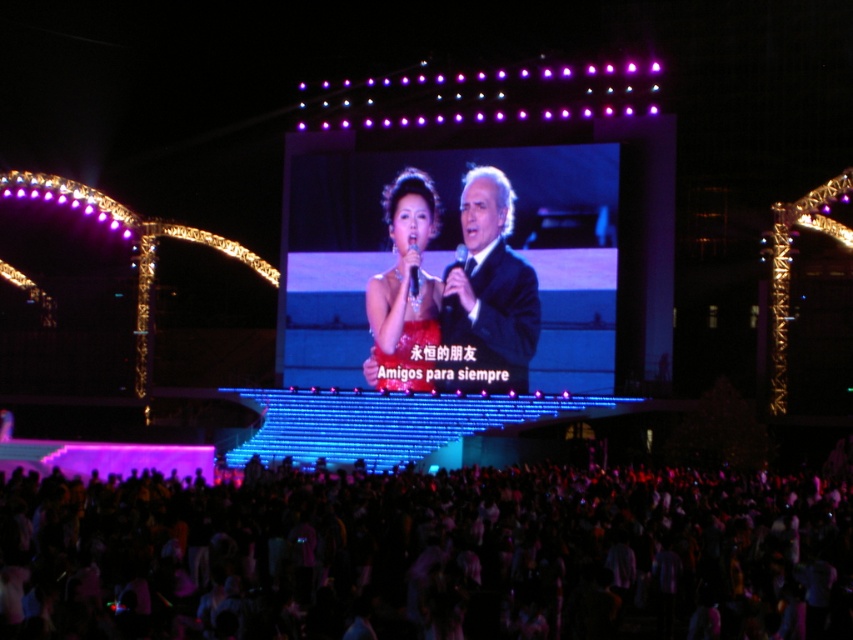
You are a stagehand who needs to move a 8.5 meter long ladder from the storage area to the stage. The ladder must be carried horizontally. Is there enough space between the shiny black screen at center and the black glossy microphone at center to move the ladder without tilting it?

The shiny black screen at center and the black glossy microphone at center are 9.01 meters apart, so yes, the ladder can be moved horizontally between them since the distance is greater than the ladder length.

You are a photographer at the concert and want to capture both the shiny black screen at center and the black glossy microphone at center in a single frame. Which object should you focus on first to ensure both are in the frame?

Since the shiny black screen at center is larger than the black glossy microphone at center, you should focus on the shiny black screen at center first to ensure it fits within the frame, allowing the smaller microphone to also be captured.